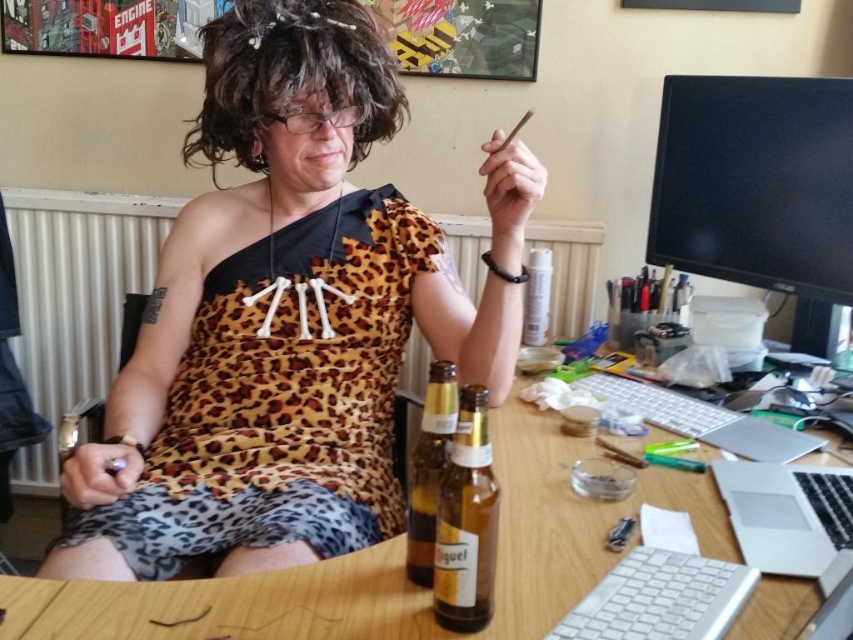
Looking at this image, you are organizing the desk in the image. You need to move the brown glass bottle at center to the right side of the silver metallic laptop at right. Is there enough space between them to do this?

The brown glass bottle at center is currently to the left of the silver metallic laptop at right. Since you want to move it to the right side of the laptop, there must be sufficient space between them. However, without knowing the exact dimensions of the objects and the desk, it is impossible to determine if there is enough space to perform this rearrangement.

You are a delivery person who needs to place a small package on the desk. The package must be placed exactly at the point marked as point (x=466, y=522). Which object is currently occupying that location?

The brown glass bottle at center is located at point (x=466, y=522), so that object is currently occupying that location.

You are a delivery robot that is 15 inches wide. You need to deliver a package to the silver metallic laptop at lower right. Can you fit through the space between the desk edge and the nearest obstacle?

The silver metallic laptop at lower right and viewer are 27.77 inches apart. Since the robot is 15 inches wide, it can fit through the space as 27.77 inches is wider than the robot.